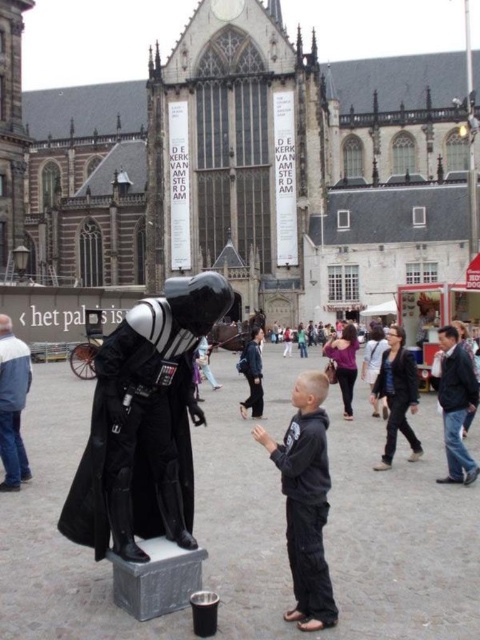
Question: Which point is farther to the camera?

Choices:
 (A) shiny black armor at center
 (B) dark blue jeans at lower right
 (C) dark gray fabric robe at lower right

Answer: (C)

Question: Estimate the real-world distances between objects in this image. Which object is farther from the dark blue jeans at lower right?

Choices:
 (A) dark gray fabric robe at lower right
 (B) dark gray hoodie at center
 (C) black matte robe at center

Answer: (C)

Question: Does dark gray hoodie at center appear on the left side of dark blue jeans at lower right?

Choices:
 (A) no
 (B) yes

Answer: (B)

Question: Is dark blue jeans at lower right thinner than black matte robe at center?

Choices:
 (A) yes
 (B) no

Answer: (B)

Question: Which point is closer to the camera?

Choices:
 (A) (251, 376)
 (B) (159, 376)

Answer: (B)

Question: Is the position of dark blue jeans at lower right less distant than that of black matte robe at center?

Choices:
 (A) no
 (B) yes

Answer: (B)